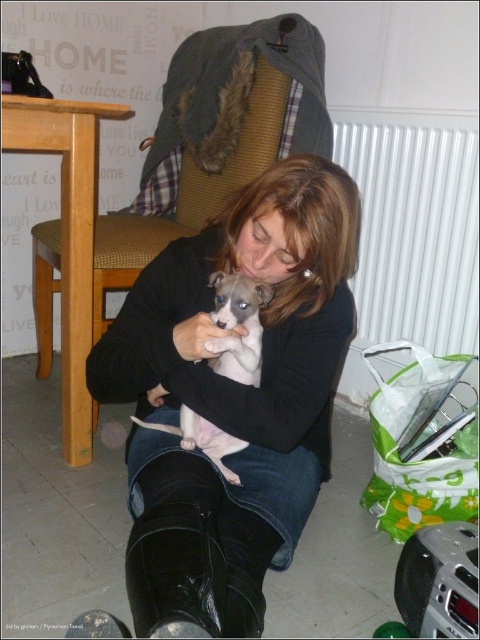
You are standing in the room and want to place a small plant pot at the point marked as point (262, 256). If the plant pot requires 0.8 meters of space in front of it to grow properly, will there be enough space between the plant pot and the nearest obstacle?

The distance of point (262, 256) from camera is 1.00 meters. Since the plant pot needs 0.8 meters of space, there is enough space as 1.00 meters is greater than 0.8 meters.

From the picture: What are the coordinates of the black leather boots at lower center?

The black leather boots at lower center are located at coordinates point (232, 397).